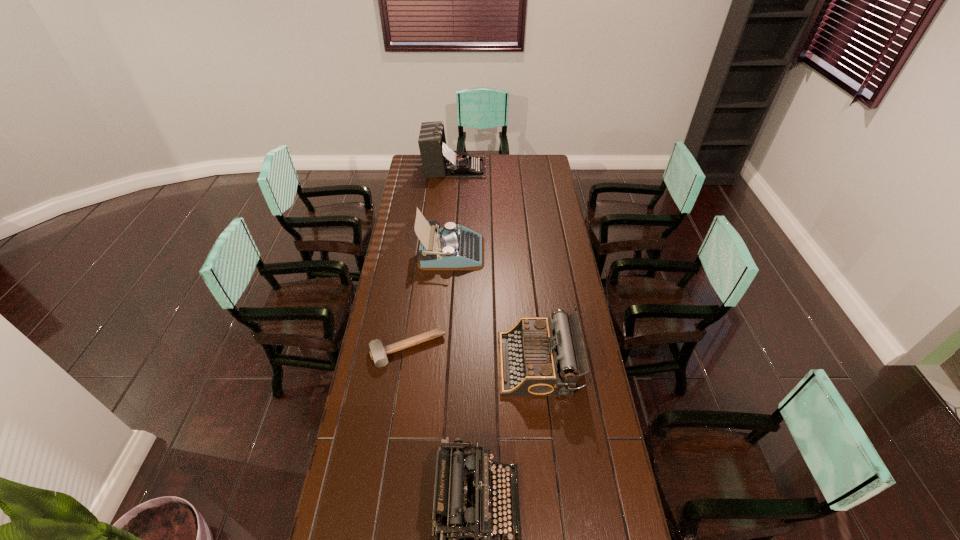
I want to click on vacant space located 0.100m on the front of the shortest object, so click(x=401, y=392).

This screenshot has height=540, width=960. What are the coordinates of `object located in the far edge section of the desktop` in the screenshot? It's located at (438, 160).

At what (x,y) coordinates should I click in order to perform the action: click on mallet at the left edge. Please return your answer as a coordinate pair (x, y). Looking at the image, I should click on (378, 353).

The height and width of the screenshot is (540, 960). Find the location of `object located in the right edge section of the desktop`. object located in the right edge section of the desktop is located at coordinates (537, 357).

You are a GUI agent. You are given a task and a screenshot of the screen. Output one action in this format:
    pyautogui.click(x=<x>, y=<y>)
    Task: Click on the object located at the far left corner
    
    Given the screenshot: What is the action you would take?
    pyautogui.click(x=438, y=160)

You are a GUI agent. You are given a task and a screenshot of the screen. Output one action in this format:
    pyautogui.click(x=<x>, y=<y>)
    Task: Click on the free space at the left edge of the desktop
    
    Given the screenshot: What is the action you would take?
    pyautogui.click(x=390, y=261)

Identify the location of free location at the right edge of the desktop. (617, 533).

Find the location of a particular element. free space between the tallest typewriter and the second nearest typewriter is located at coordinates (496, 266).

Identify the location of vacant space that's between the third nearest typewriter and the mallet. (429, 301).

What are the coordinates of `empty space that is in between the second farthest typewriter and the mallet` in the screenshot? It's located at (429, 301).